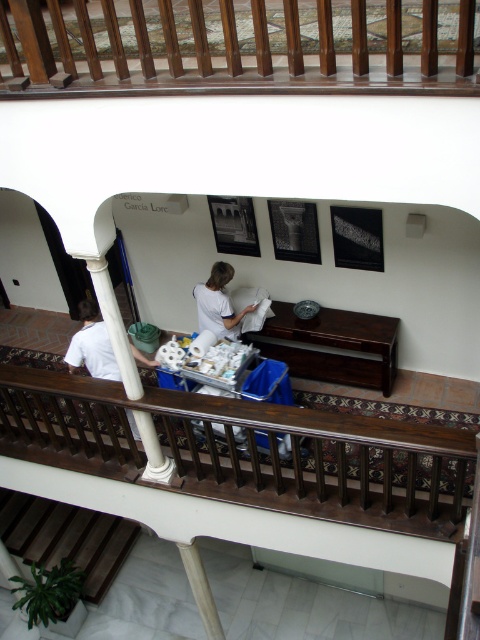
Question: Which of the following is the farthest from the observer?

Choices:
 (A) (219, 336)
 (B) (309, 60)

Answer: (A)

Question: Which of the following is the farthest from the observer?

Choices:
 (A) brown wooden balustrade at lower center
 (B) wooden stairs at lower left
 (C) wooden railing at upper center
 (D) dark wood table at center

Answer: (B)

Question: Is brown wooden balustrade at lower center below wooden stairs at lower left?

Choices:
 (A) yes
 (B) no

Answer: (B)

Question: Which object is farther from the camera taking this photo?

Choices:
 (A) wooden stairs at lower left
 (B) wooden railing at upper center

Answer: (A)

Question: Is brown wooden balustrade at lower center above wooden stairs at lower left?

Choices:
 (A) no
 (B) yes

Answer: (B)

Question: Can you confirm if brown wooden balustrade at lower center is positioned above dark wood table at center?

Choices:
 (A) yes
 (B) no

Answer: (B)